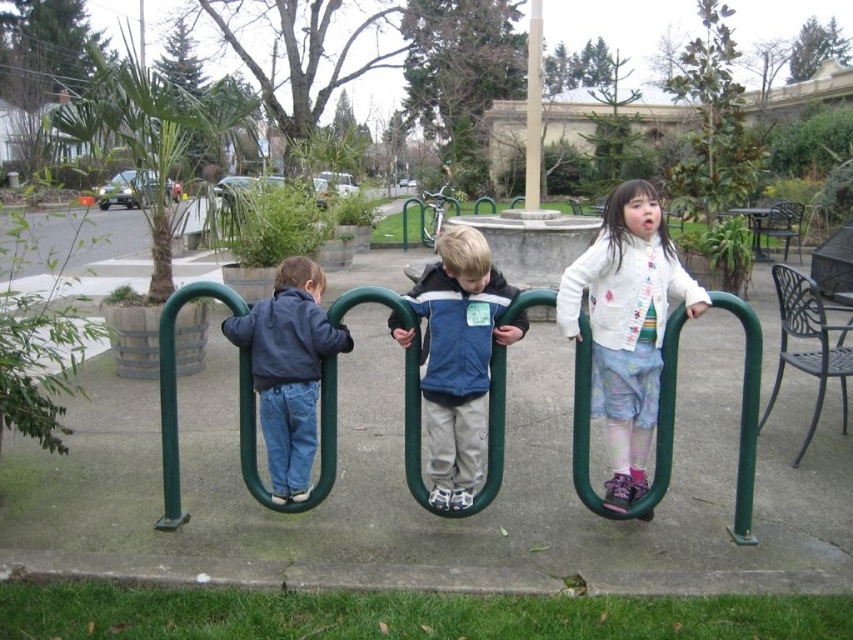
Question: Which of the following is the farthest from the observer?

Choices:
 (A) green plastic playground equipment at center
 (B) matte blue jacket at left
 (C) smooth beige pole at center

Answer: (C)

Question: Which object appears farthest from the camera in this image?

Choices:
 (A) blue fleece jacket at center
 (B) smooth beige pole at center

Answer: (B)

Question: Among these points, which one is farthest from the camera?

Choices:
 (A) (312, 445)
 (B) (463, 458)

Answer: (A)

Question: Is blue fleece jacket at center further to the viewer compared to smooth beige pole at center?

Choices:
 (A) no
 (B) yes

Answer: (A)

Question: Can you confirm if pastel floral sweater at center is bigger than blue fleece jacket at center?

Choices:
 (A) no
 (B) yes

Answer: (B)

Question: Can you confirm if pastel floral sweater at center is wider than smooth beige pole at center?

Choices:
 (A) yes
 (B) no

Answer: (B)